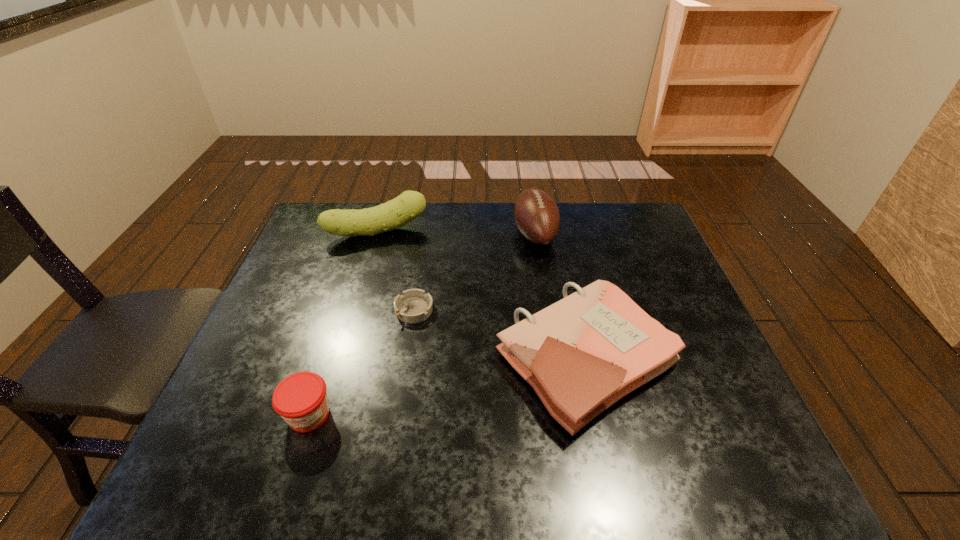
Locate an element on the screen. This screenshot has width=960, height=540. football (American) is located at coordinates (536, 214).

Where is `cucumber`? cucumber is located at coordinates (395, 213).

Identify the location of phonebook. The width and height of the screenshot is (960, 540). (582, 354).

This screenshot has height=540, width=960. I want to click on jam, so click(x=300, y=399).

This screenshot has width=960, height=540. I want to click on the shortest object, so click(x=414, y=305).

Identify the location of vacant space located on the left of the football (American). (456, 234).

The width and height of the screenshot is (960, 540). I want to click on vacant area situated on the right of the cucumber, so click(502, 231).

Identify the location of vacant space located on the front of the phonebook. The height and width of the screenshot is (540, 960). (609, 465).

Image resolution: width=960 pixels, height=540 pixels. I want to click on free space located on the label side of the jam, so click(291, 471).

I want to click on free space located 0.250m on the back of the shortest object, so click(424, 242).